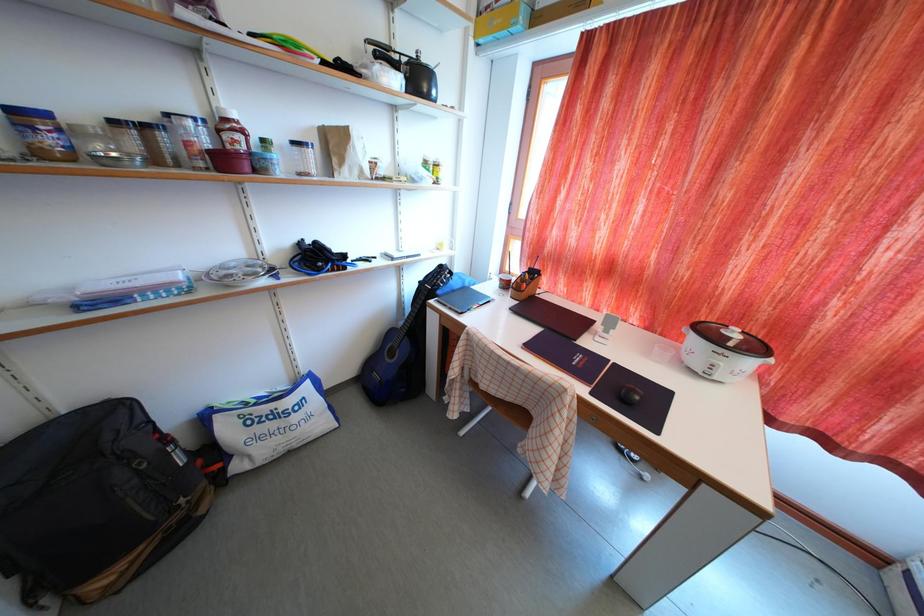
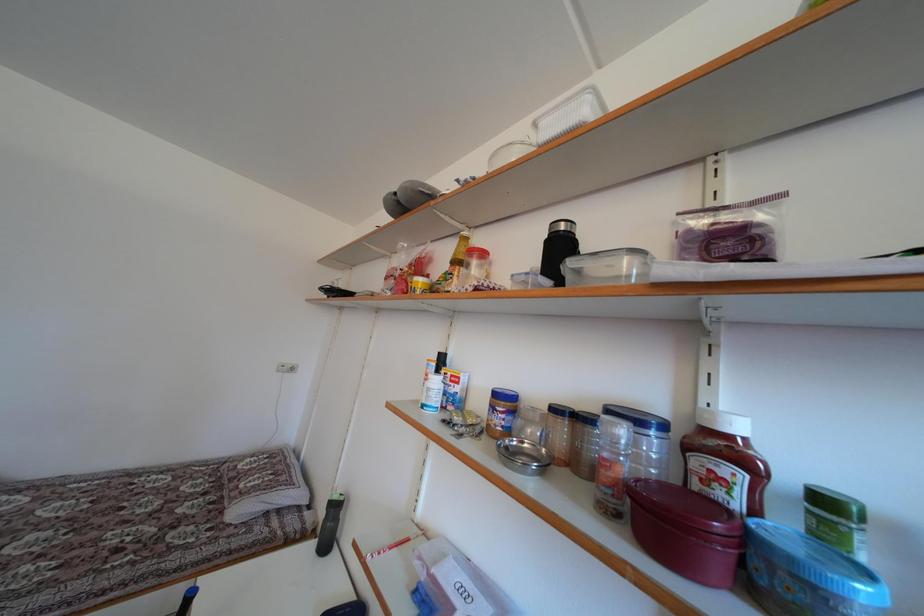
Question: The camera is either moving clockwise (left) or counter-clockwise (right) around the object. The first image is from the beginning of the video and the second image is from the end. Is the camera moving left or right when shooting the video?

Choices:
 (A) Left
 (B) Right

Answer: (B)